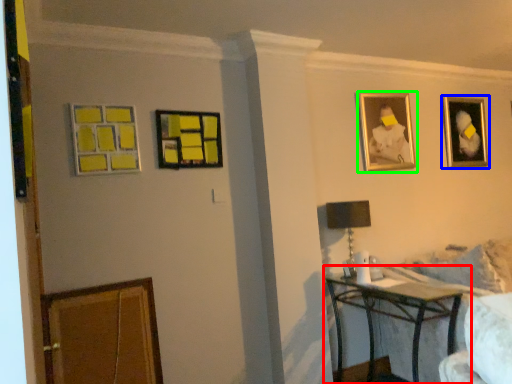
Question: Estimate the real-world distances between objects in this image. Which object is closer to table (highlighted by a red box), picture frame (highlighted by a blue box) or picture frame (highlighted by a green box)?

Choices:
 (A) picture frame
 (B) picture frame

Answer: (B)